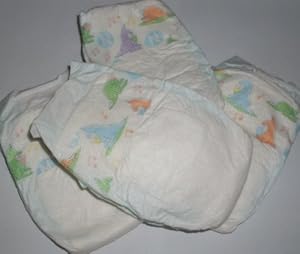
Where is `white table/surface`? The width and height of the screenshot is (300, 254). white table/surface is located at coordinates (33, 32).